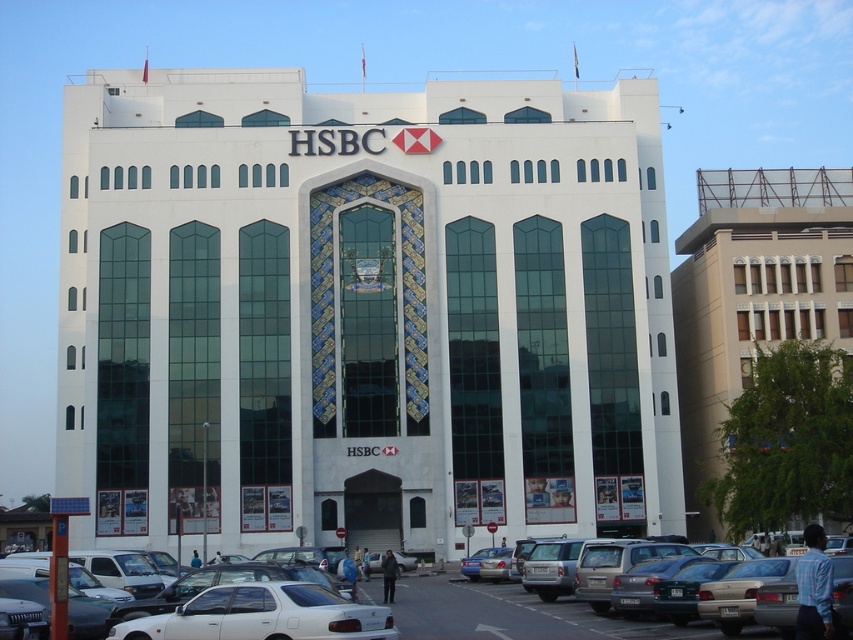
Based on the photo, you are standing at the entrance of the HSBC building and want to park your white glossy sedan at center. The parking spot you want is located at point (263,616). Can you determine if the parking spot is directly in front of the HSBC logo?

The point (263,616) marks the white glossy sedan at center, which is where the parking spot is located. Since the HSBC logo is at the top center of the building, the parking spot is directly in front of it.

You are a delivery person who needs to park your van next to the white matte cars at lower center and the silver metallic sedan at lower center. Which vehicle should you park behind to ensure your van doesn t block the entrance of the building?

You should park behind the white matte cars at lower center because it is much taller than the silver metallic sedan at lower center, providing better visibility and preventing obstruction of the entrance.